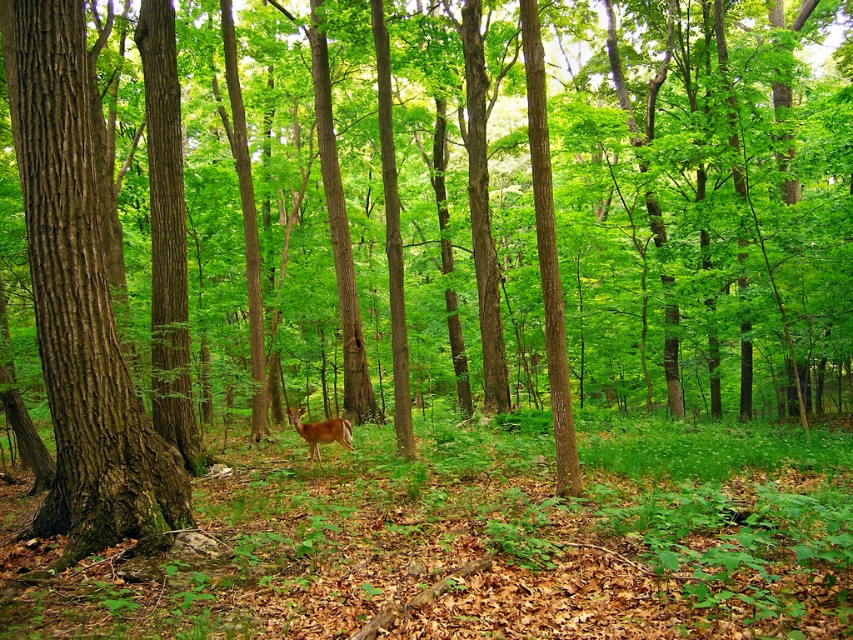
You are a photographer standing in the forest. You notice the brown textured bark at left and the brown fur deer at center. Which object is positioned higher in the scene?

The brown textured bark at left is located above the brown fur deer at center, so it is positioned higher in the scene.

You are a hiker who wants to take a photo of the brown fur deer at center. You have a camera with a zoom lens. Since the brown textured bark at left is blocking your view, can you zoom in enough to focus on the deer without moving closer?

The brown textured bark at left is smaller in size compared to the brown fur deer at center. Since the bark is smaller, it might not fully block the view of the deer. However, the exact visibility depends on their positions and distances. If the bark is closer to you and the deer is further back, zooming could help focus on the deer by reducing the bark obstruction. Alternatively, if the bark is between you and the deer, zooming might still allow capturing parts of the deer by adjusting the framing.

You are a botanist studying the forest. You need to locate the brown textured bark at left. According to the coordinates provided, where exactly is it positioned in the image?

The brown textured bark at left is positioned at coordinates point (78, 300).